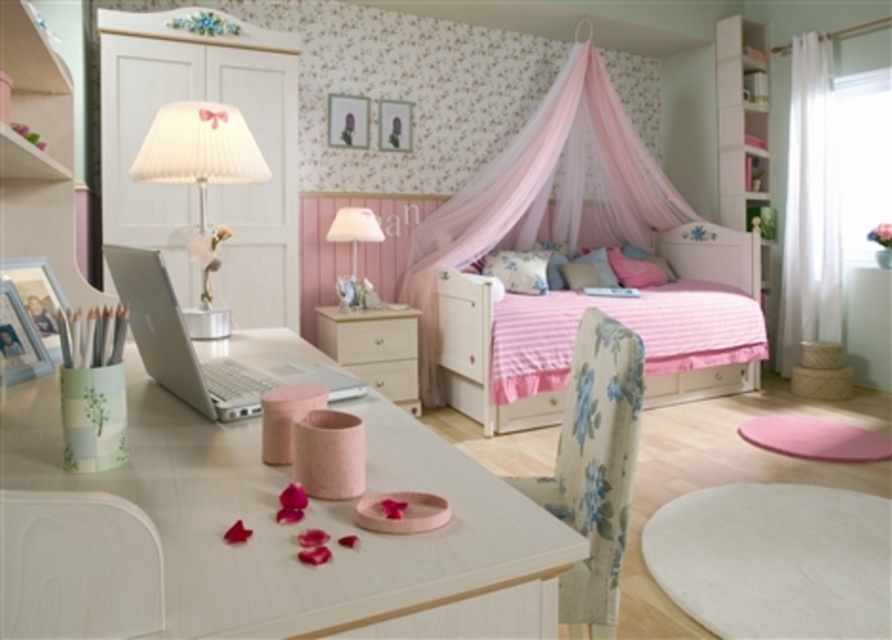
How distant is floral fabric chair at center from white pleated fabric lampshade at upper left?

The distance of floral fabric chair at center from white pleated fabric lampshade at upper left is 3.65 feet.

Which is more to the left, floral fabric chair at center or white pleated fabric lampshade at upper left?

white pleated fabric lampshade at upper left

Does point (625, 534) come farther from viewer compared to point (219, 131)?

That is False.

Where is `floral fabric chair at center`? Image resolution: width=892 pixels, height=640 pixels. floral fabric chair at center is located at coordinates (593, 464).

Is floral fabric chair at center to the left of matte white drawer at center from the viewer's perspective?

In fact, floral fabric chair at center is to the right of matte white drawer at center.

Can you confirm if floral fabric chair at center is taller than matte white drawer at center?

Correct, floral fabric chair at center is much taller as matte white drawer at center.

What do you see at coordinates (593, 464) in the screenshot?
I see `floral fabric chair at center` at bounding box center [593, 464].

The width and height of the screenshot is (892, 640). I want to click on floral fabric chair at center, so click(x=593, y=464).

Between white wood table at center and white glossy drawer at center, which one is positioned lower?

white glossy drawer at center is below.

Can you confirm if white wood table at center is positioned above white glossy drawer at center?

Correct, white wood table at center is located above white glossy drawer at center.

The width and height of the screenshot is (892, 640). Describe the element at coordinates (257, 534) in the screenshot. I see `white wood table at center` at that location.

This screenshot has width=892, height=640. In order to click on white wood table at center in this screenshot , I will do `click(257, 534)`.